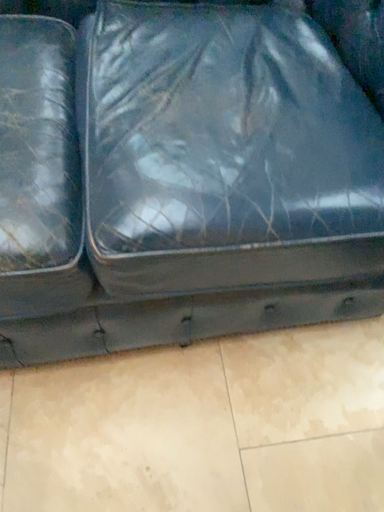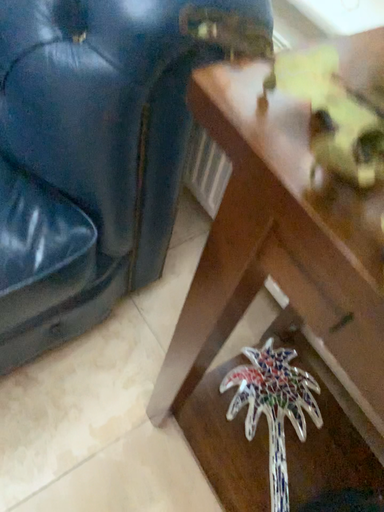
Question: Which way did the camera rotate in the video?

Choices:
 (A) rotated right
 (B) rotated left

Answer: (A)